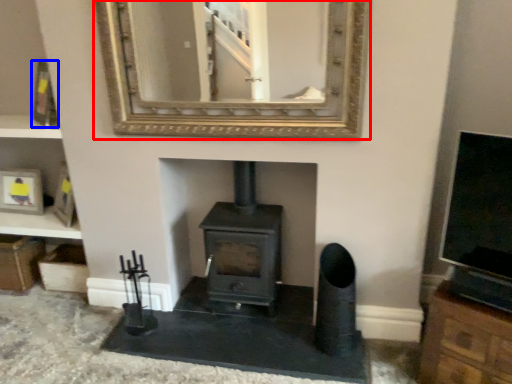
Question: Among these objects, which one is farthest to the camera, mirror (highlighted by a red box) or picture frame (highlighted by a blue box)?

Choices:
 (A) mirror
 (B) picture frame

Answer: (B)